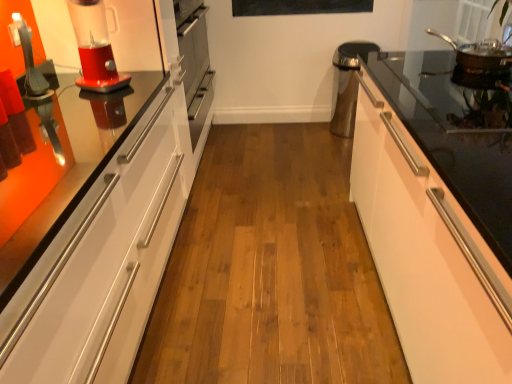
What is the approximate width of black matte bulletin board at upper center?

The width of black matte bulletin board at upper center is 2.41 inches.

Identify the location of stainless steel frying pan at upper right. (479, 55).

Identify the location of black matte bulletin board at upper center. The width and height of the screenshot is (512, 384). (298, 7).

From the image's perspective, is white glossy cabinet at right located above or below stainless steel frying pan at upper right?

From the image's perspective, white glossy cabinet at right appears below stainless steel frying pan at upper right.

Which object is thinner, white glossy cabinet at right or stainless steel frying pan at upper right?

Thinner between the two is stainless steel frying pan at upper right.

Considering the sizes of objects white glossy cabinet at right and stainless steel frying pan at upper right in the image provided, who is taller, white glossy cabinet at right or stainless steel frying pan at upper right?

white glossy cabinet at right is taller.

Is white glossy cabinet at right oriented towards stainless steel frying pan at upper right?

No, white glossy cabinet at right is not oriented towards stainless steel frying pan at upper right.

Does black matte bulletin board at upper center have a greater height compared to satin silver oven at center?

No, black matte bulletin board at upper center is not taller than satin silver oven at center.

Considering the positions of points (285, 5) and (188, 19), is point (285, 5) farther from camera compared to point (188, 19)?

Yes, point (285, 5) is behind point (188, 19).

Does black matte bulletin board at upper center turn towards satin silver oven at center?

No, black matte bulletin board at upper center does not turn towards satin silver oven at center.

From the image's perspective, is black matte bulletin board at upper center positioned above or below satin silver oven at center?

black matte bulletin board at upper center is situated higher than satin silver oven at center in the image.

From the image's perspective, is white glossy cabinet at right on translucent plastic blender at left?

No, from the image's perspective, white glossy cabinet at right is not above translucent plastic blender at left.

Consider the image. Is translucent plastic blender at left surrounded by white glossy cabinet at right?

No, translucent plastic blender at left is located outside of white glossy cabinet at right.

Is white glossy cabinet at right in front of or behind translucent plastic blender at left in the image?

In the image, white glossy cabinet at right appears in front of translucent plastic blender at left.

Between white glossy cabinet at right and translucent plastic blender at left, which one appears on the right side from the viewer's perspective?

white glossy cabinet at right is more to the right.

From a real-world perspective, is stainless steel frying pan at upper right positioned above or below white glossy cabinet at right?

stainless steel frying pan at upper right is situated higher than white glossy cabinet at right in the real world.

From the picture: Considering the sizes of objects stainless steel frying pan at upper right and white glossy cabinet at right in the image provided, who is smaller, stainless steel frying pan at upper right or white glossy cabinet at right?

stainless steel frying pan at upper right.

Consider the image. From the image's perspective, would you say stainless steel frying pan at upper right is positioned over white glossy cabinet at right?

Yes, from the image's perspective, stainless steel frying pan at upper right is over white glossy cabinet at right.

What's the angular difference between stainless steel frying pan at upper right and white glossy cabinet at right's facing directions?

128 degrees.

From a real-world perspective, which object rests below the other?

white glossy cabinet at right is physically lower.

Could you tell me if black matte bulletin board at upper center is turned towards white glossy cabinet at right?

No, black matte bulletin board at upper center is not facing towards white glossy cabinet at right.

Can you tell me how much black matte bulletin board at upper center and white glossy cabinet at right differ in facing direction?

The facing directions of black matte bulletin board at upper center and white glossy cabinet at right are 89.2 degrees apart.

Who is smaller, black matte bulletin board at upper center or white glossy cabinet at right?

black matte bulletin board at upper center is smaller.

Is satin silver oven at center bigger than translucent plastic blender at left?

Correct, satin silver oven at center is larger in size than translucent plastic blender at left.

Considering the positions of objects satin silver oven at center and translucent plastic blender at left in the image provided, who is behind, satin silver oven at center or translucent plastic blender at left?

satin silver oven at center is more distant.

Is satin silver oven at center located outside translucent plastic blender at left?

Absolutely, satin silver oven at center is external to translucent plastic blender at left.

From a real-world perspective, relative to translucent plastic blender at left, is satin silver oven at center vertically above or below?

satin silver oven at center is situated lower than translucent plastic blender at left in the real world.

From the image's perspective, is satin silver oven at center located above or below white glossy cabinet at right?

Clearly, from the image's perspective, satin silver oven at center is above white glossy cabinet at right.

Is satin silver oven at center thinner than white glossy cabinet at right?

Correct, the width of satin silver oven at center is less than that of white glossy cabinet at right.

I want to click on cabinetry below the stainless steel frying pan at upper right (from the image's perspective), so click(x=428, y=255).

This screenshot has height=384, width=512. In order to click on bulletin board located on the right of satin silver oven at center in this screenshot , I will do `click(298, 7)`.

Based on their spatial positions, is white glossy cabinet at right or black matte bulletin board at upper center further from stainless steel frying pan at upper right?

black matte bulletin board at upper center is further to stainless steel frying pan at upper right.

From the image, which object appears to be nearer to black matte bulletin board at upper center, satin silver oven at center or white glossy cabinet at right?

satin silver oven at center is positioned closer to the anchor black matte bulletin board at upper center.

From the image, which object appears to be farther from white glossy cabinet at right, black matte bulletin board at upper center or translucent plastic blender at left?

black matte bulletin board at upper center.

Considering their positions, is black matte bulletin board at upper center positioned further to white glossy cabinet at right than stainless steel frying pan at upper right?

black matte bulletin board at upper center.

When comparing their distances from stainless steel frying pan at upper right, does satin silver oven at center or black matte bulletin board at upper center seem further?

Among the two, satin silver oven at center is located further to stainless steel frying pan at upper right.

When comparing their distances from stainless steel frying pan at upper right, does satin silver oven at center or white glossy cabinet at right seem closer?

white glossy cabinet at right is positioned closer to the anchor stainless steel frying pan at upper right.

When comparing their distances from translucent plastic blender at left, does black matte bulletin board at upper center or white glossy cabinet at right seem further?

black matte bulletin board at upper center is further to translucent plastic blender at left.

Looking at the image, which one is located closer to black matte bulletin board at upper center, translucent plastic blender at left or stainless steel frying pan at upper right?

stainless steel frying pan at upper right lies closer to black matte bulletin board at upper center than the other object.

Where is `oven between translucent plastic blender at left and stainless steel frying pan at upper right from left to right`? The image size is (512, 384). oven between translucent plastic blender at left and stainless steel frying pan at upper right from left to right is located at coordinates (194, 64).

This screenshot has width=512, height=384. In order to click on home appliance between white glossy cabinet at right and satin silver oven at center in the front-back direction in this screenshot , I will do `click(95, 47)`.

Identify the location of kitchen appliance between white glossy cabinet at right and satin silver oven at center from front to back. This screenshot has height=384, width=512. (479, 55).

Image resolution: width=512 pixels, height=384 pixels. Identify the location of kitchen appliance between translucent plastic blender at left and black matte bulletin board at upper center along the z-axis. (479, 55).